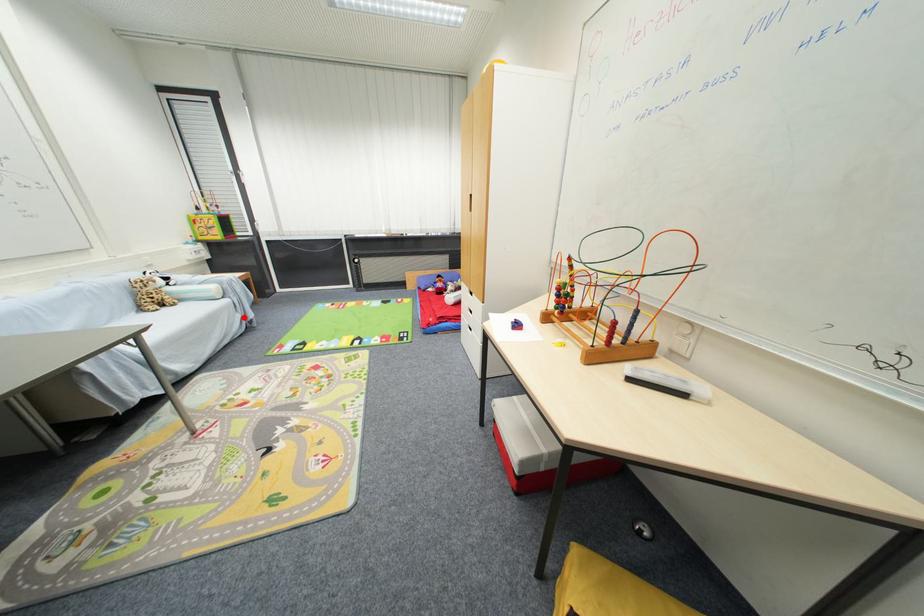
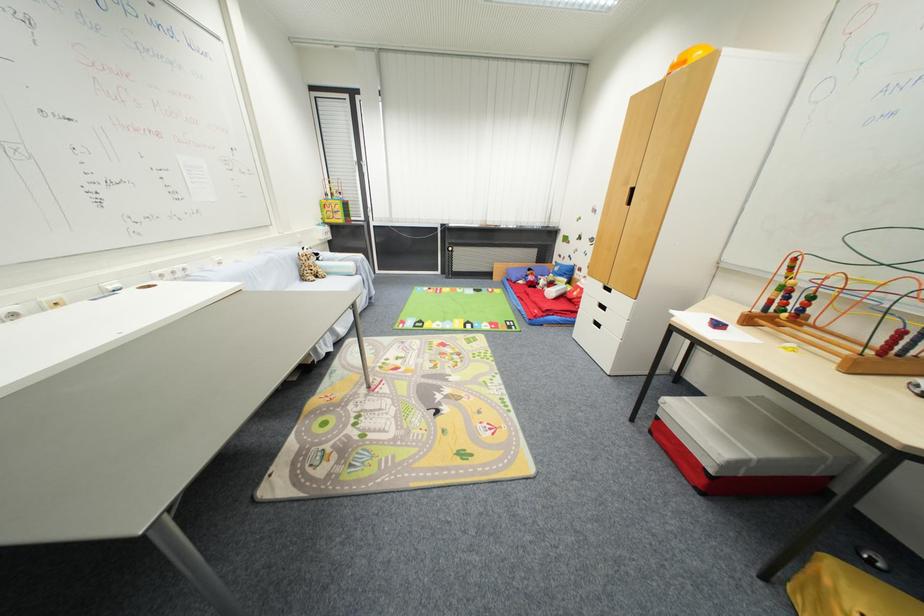
Find the pixel in the second image that matches the highlighted location in the first image.

(371, 293)